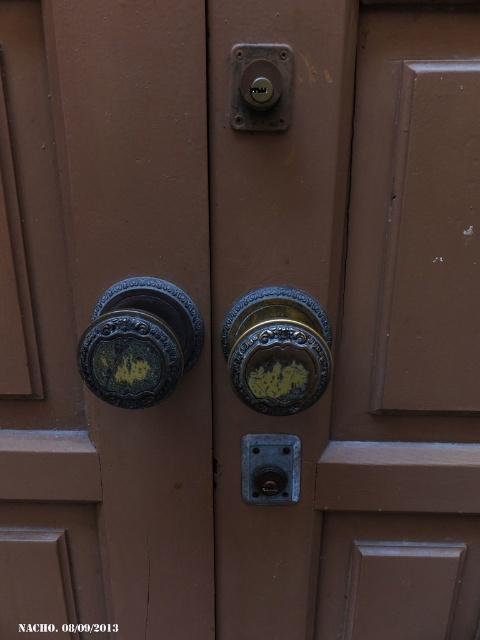
Who is higher up, gold ornate door handle at center or matte brass lock at upper center?

matte brass lock at upper center

Does gold ornate door handle at center appear on the right side of matte brass lock at upper center?

Yes, gold ornate door handle at center is to the right of matte brass lock at upper center.

Where is `gold ornate door handle at center`? This screenshot has height=640, width=480. gold ornate door handle at center is located at coordinates click(x=276, y=349).

Identify the location of gold ornate door handle at center. This screenshot has height=640, width=480. (276, 349).

What do you see at coordinates (90, 317) in the screenshot? The width and height of the screenshot is (480, 640). I see `green patina brass doorknob at center` at bounding box center [90, 317].

In the scene shown: Does green patina brass doorknob at center lie in front of green patina metal at left?

That is False.

Which is behind, point (104, 440) or point (160, 310)?

Positioned behind is point (104, 440).

Find the location of a particular element. The image size is (480, 640). green patina brass doorknob at center is located at coordinates (90, 317).

Does matte brass lock at upper center have a greater width compared to matte brass doorbell at center?

Yes.

Between matte brass lock at upper center and matte brass doorbell at center, which one has more height?

Standing taller between the two is matte brass lock at upper center.

Find the location of a particular element. Image resolution: width=480 pixels, height=640 pixels. matte brass lock at upper center is located at coordinates (261, 86).

The image size is (480, 640). Find the location of `matte brass lock at upper center`. matte brass lock at upper center is located at coordinates (261, 86).